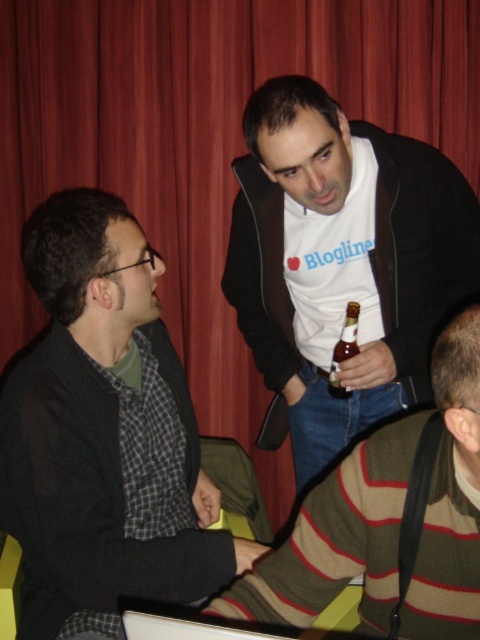
You are a photographer setting up for a photo shoot. You need to place a small tripod between the striped wool sweater at lower right and the brown glass bottle at center. Based on their positions, where should you place the tripod to ensure it is between them?

The striped wool sweater at lower right is positioned on the right side of brown glass bottle at center, so placing the tripod to the left of the striped wool sweater at lower right and to the right of the brown glass bottle at center would position it between them.

Consider the image. You are a photographer setting up a camera at the back of the room. You want to capture both the white matte shirt at center and the striped wool sweater at lower right in the same frame. Which object should you focus on first to ensure both are in focus?

The white matte shirt at center is above the striped wool sweater at lower right, so you should focus on the white matte shirt at center first to ensure both are in focus.

Looking at this image, you are a photographer setting up a tripod to take a portrait of the white matte shirt at center and the brown glass bottle at center. The tripod has a height limit of 1.8 meters. Can both subjects fit within the frame without adjusting the tripod height?

The white matte shirt at center is taller than the brown glass bottle at center. Since the white matte shirt at center is the taller subject and the tripod has a height limit of 1.8 meters, it depends on the actual height of the white matte shirt at center. If its height is within 1.8 meters, both can fit. However, without specific measurements, we cannot confirm.